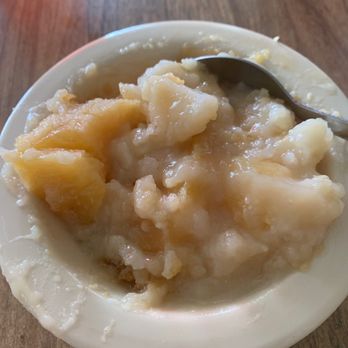
The image size is (348, 348). What are the coordinates of `spoon` in the screenshot? It's located at 246,74.